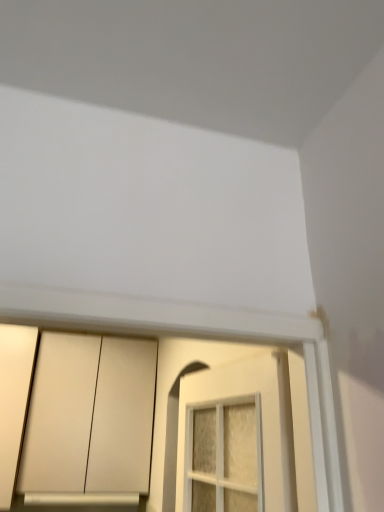
Question: Is silver metallic window sill at lower center facing away from matte white door at lower left?

Choices:
 (A) yes
 (B) no

Answer: (B)

Question: Can you confirm if silver metallic window sill at lower center is shorter than matte white door at lower left?

Choices:
 (A) no
 (B) yes

Answer: (B)

Question: Considering the relative positions of silver metallic window sill at lower center and matte white door at lower left in the image provided, is silver metallic window sill at lower center to the left of matte white door at lower left from the viewer's perspective?

Choices:
 (A) yes
 (B) no

Answer: (B)

Question: Is silver metallic window sill at lower center oriented towards matte white door at lower left?

Choices:
 (A) no
 (B) yes

Answer: (A)

Question: Can you confirm if silver metallic window sill at lower center is wider than matte white door at lower left?

Choices:
 (A) yes
 (B) no

Answer: (B)

Question: Looking at the image, does silver metallic window sill at lower center seem bigger or smaller compared to matte white cabinet at lower left?

Choices:
 (A) small
 (B) big

Answer: (A)

Question: Considering their positions, is silver metallic window sill at lower center located in front of or behind matte white cabinet at lower left?

Choices:
 (A) behind
 (B) front

Answer: (A)

Question: Visually, is silver metallic window sill at lower center positioned to the left or to the right of matte white cabinet at lower left?

Choices:
 (A) left
 (B) right

Answer: (A)

Question: Is silver metallic window sill at lower center spatially inside matte white cabinet at lower left, or outside of it?

Choices:
 (A) outside
 (B) inside

Answer: (B)

Question: From the image's perspective, is matte white door at lower left located above or below matte white cabinet at lower left?

Choices:
 (A) above
 (B) below

Answer: (A)

Question: Would you say matte white door at lower left is to the left or to the right of matte white cabinet at lower left in the picture?

Choices:
 (A) left
 (B) right

Answer: (A)

Question: In terms of height, does matte white door at lower left look taller or shorter compared to matte white cabinet at lower left?

Choices:
 (A) short
 (B) tall

Answer: (B)

Question: Is point (0, 367) closer or farther from the camera than point (31, 417)?

Choices:
 (A) closer
 (B) farther

Answer: (A)

Question: From the image's perspective, is matte white cabinet at lower left positioned above or below matte white door at lower left?

Choices:
 (A) below
 (B) above

Answer: (A)

Question: Is matte white cabinet at lower left inside or outside of matte white door at lower left?

Choices:
 (A) inside
 (B) outside

Answer: (B)